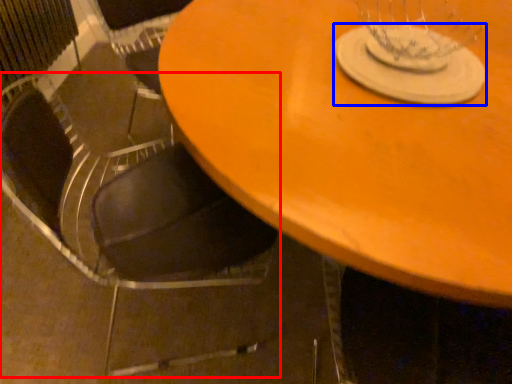
Question: Which object is closer to the camera taking this photo, chair (highlighted by a red box) or glass plate (highlighted by a blue box)?

Choices:
 (A) chair
 (B) glass plate

Answer: (A)